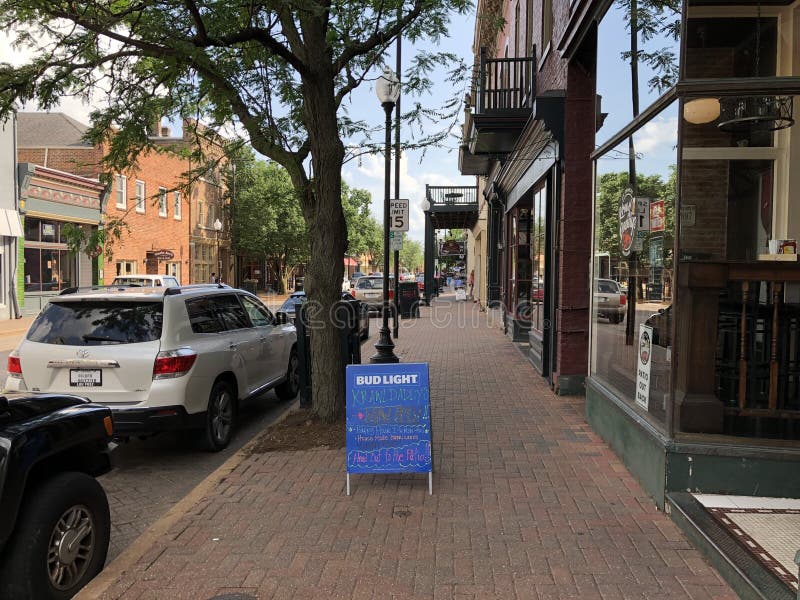
Locate an element on the screen. The height and width of the screenshot is (600, 800). lamp is located at coordinates (216, 227).